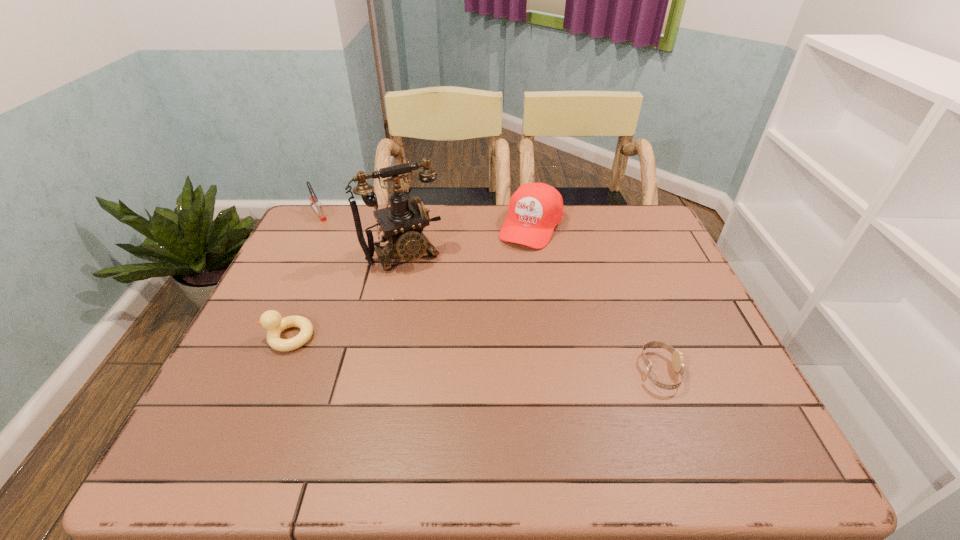
Find the location of `baseball cap that is at the far edge`. baseball cap that is at the far edge is located at coordinates (534, 210).

The image size is (960, 540). I want to click on stapler at the far edge, so click(x=317, y=206).

Where is `object present at the near edge`? The height and width of the screenshot is (540, 960). object present at the near edge is located at coordinates (677, 356).

The height and width of the screenshot is (540, 960). I want to click on duckling at the left edge, so click(x=271, y=320).

Locate an element on the screen. The width and height of the screenshot is (960, 540). stapler present at the left edge is located at coordinates [x=317, y=206].

You are a GUI agent. You are given a task and a screenshot of the screen. Output one action in this format:
    pyautogui.click(x=<x>, y=<y>)
    Task: Click on the object situated at the right edge
    The width and height of the screenshot is (960, 540).
    Given the screenshot: What is the action you would take?
    pyautogui.click(x=677, y=356)

Locate an element on the screen. Image resolution: width=960 pixels, height=540 pixels. object that is at the far left corner is located at coordinates (317, 206).

Locate an element on the screen. The width and height of the screenshot is (960, 540). object present at the near right corner is located at coordinates coord(677,356).

Identify the location of vacant space at the far edge of the desktop. This screenshot has width=960, height=540. (566, 218).

The height and width of the screenshot is (540, 960). In the image, there is a desktop. In order to click on vacant space at the near edge in this screenshot , I will do `click(565, 387)`.